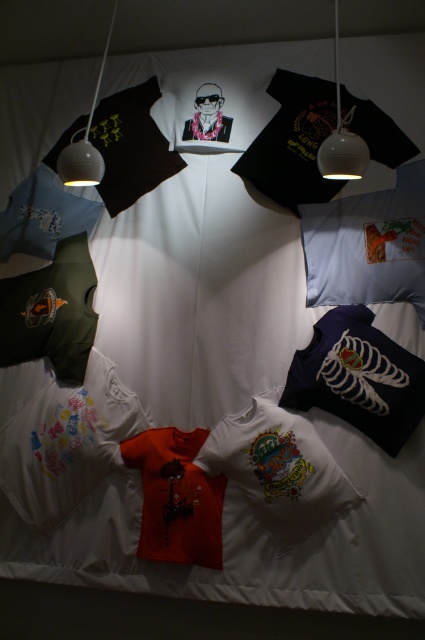
Does light blue fabric pillow at upper right appear under black matte pillow at upper left?

Correct, light blue fabric pillow at upper right is located below black matte pillow at upper left.

Based on the photo, is light blue fabric pillow at upper right in front of black matte pillow at upper left?

Yes, light blue fabric pillow at upper right is closer to the viewer.

Between point (348, 262) and point (116, 157), which one is positioned behind?

Point (116, 157)

Identify the location of light blue fabric pillow at upper right. The height and width of the screenshot is (640, 425). (368, 244).

Does white cotton t-shirt at center have a lesser height compared to navy blue fabric pillow at lower right?

No.

The image size is (425, 640). What do you see at coordinates (278, 470) in the screenshot?
I see `white cotton t-shirt at center` at bounding box center [278, 470].

Is point (300, 467) less distant than point (342, 408)?

Yes, it is in front of point (342, 408).

At what (x,y) coordinates should I click in order to perform the action: click on white cotton t-shirt at center. Please return your answer as a coordinate pair (x, y). This screenshot has width=425, height=640. Looking at the image, I should click on (278, 470).

From the picture: Can you confirm if white soft pillow at lower left is positioned above light blue fabric pillow at upper right?

Incorrect, white soft pillow at lower left is not positioned above light blue fabric pillow at upper right.

Based on the photo, who is more distant from viewer, (17,449) or (317,260)?

The point (17,449) is behind.

Is point (25, 461) more distant than point (413, 269)?

Yes, it is behind point (413, 269).

You are a GUI agent. You are given a task and a screenshot of the screen. Output one action in this format:
    pyautogui.click(x=<x>, y=<y>)
    Task: Click on the white soft pillow at lower left
    This screenshot has width=425, height=640.
    Given the screenshot: What is the action you would take?
    pyautogui.click(x=67, y=444)